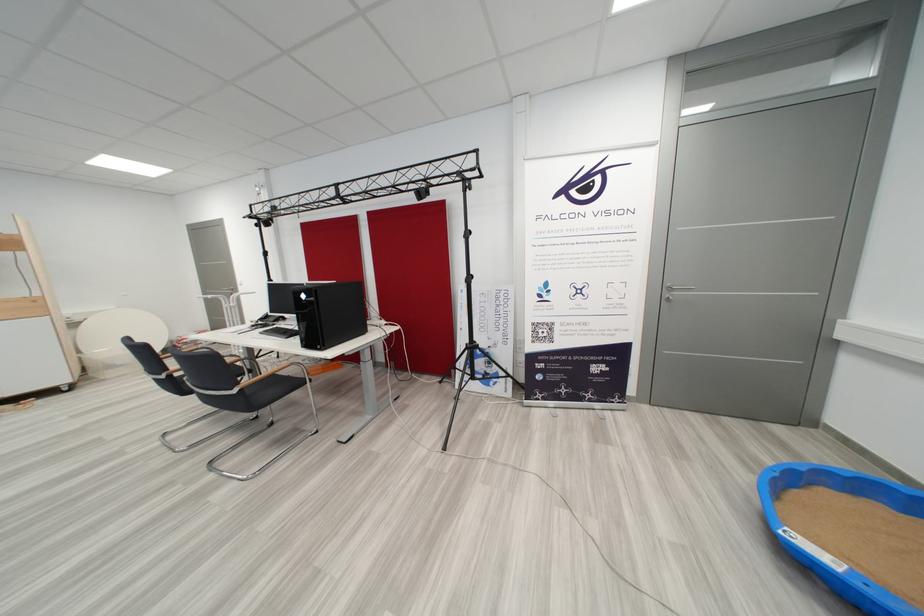
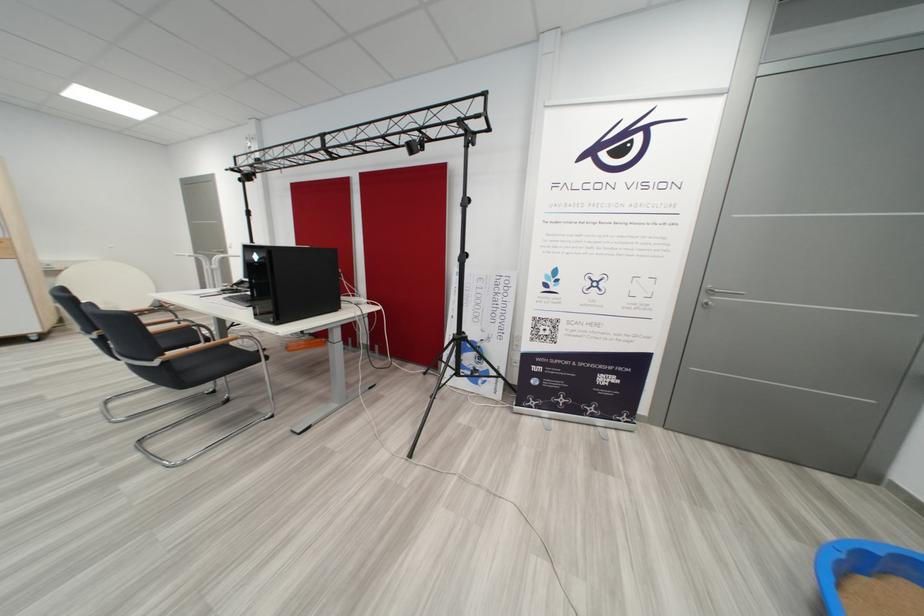
What movement of the cameraman would produce the second image?

The movement direction of the cameraman is right, forward.